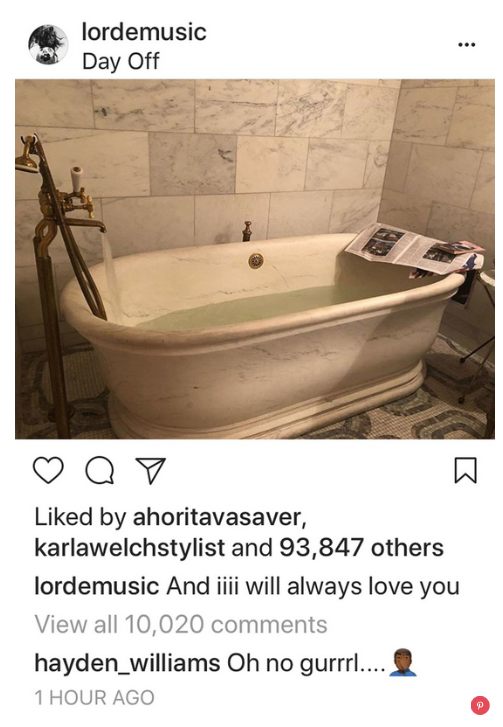
You are a GUI agent. You are given a task and a screenshot of the screen. Output one action in this format:
    pyautogui.click(x=<x>, y=<y>)
    Task: Click on the tile flooring
    This screenshot has height=727, width=503.
    Given the screenshot: What is the action you would take?
    pyautogui.click(x=384, y=422)